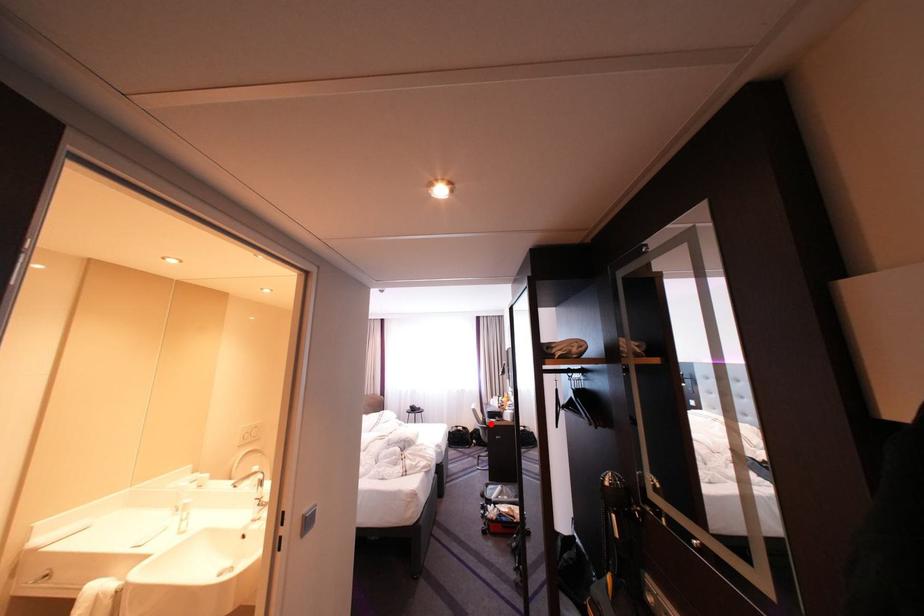
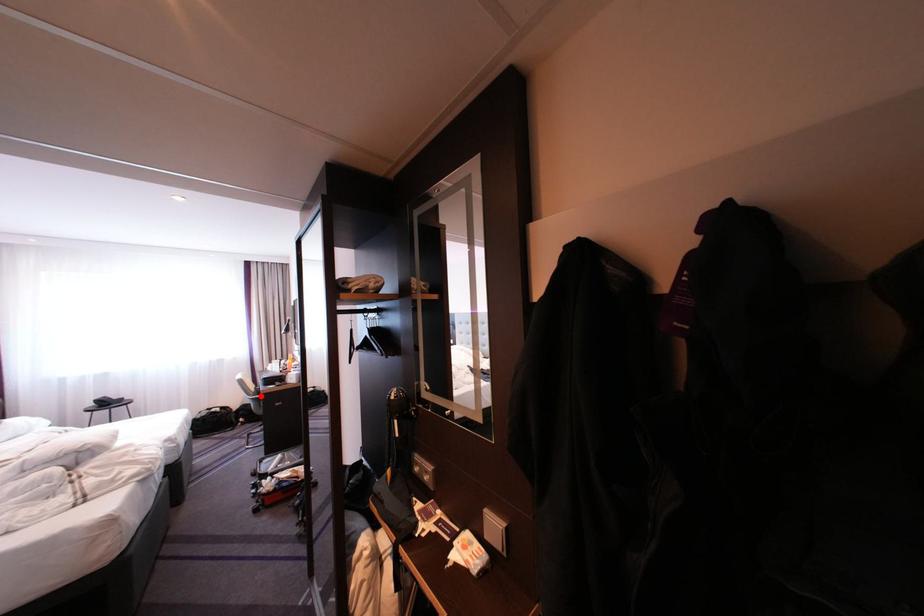
I am providing you with two images of the same scene from different viewpoints. A red point is marked on the first image and another point is marked on the second image. Are the points marked in image1 and image2 representing the same 3D position?

Yes